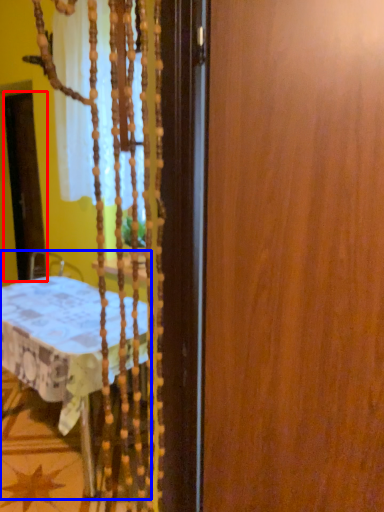
Question: Which object is further to the camera taking this photo, screen door (highlighted by a red box) or furniture (highlighted by a blue box)?

Choices:
 (A) screen door
 (B) furniture

Answer: (A)